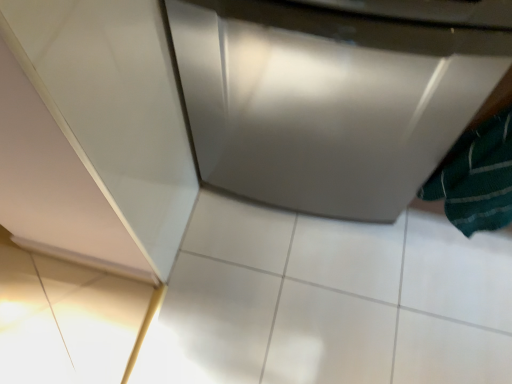
Question: Is satin silver dishwasher at center facing towards green textured towel at lower right?

Choices:
 (A) yes
 (B) no

Answer: (B)

Question: Does satin silver dishwasher at center have a greater width compared to green textured towel at lower right?

Choices:
 (A) no
 (B) yes

Answer: (B)

Question: Is satin silver dishwasher at center looking in the opposite direction of green textured towel at lower right?

Choices:
 (A) yes
 (B) no

Answer: (B)

Question: Is the depth of satin silver dishwasher at center less than that of green textured towel at lower right?

Choices:
 (A) no
 (B) yes

Answer: (A)

Question: Is satin silver dishwasher at center further to camera compared to green textured towel at lower right?

Choices:
 (A) no
 (B) yes

Answer: (B)

Question: Is satin silver dishwasher at center completely or partially outside of green textured towel at lower right?

Choices:
 (A) no
 (B) yes

Answer: (B)

Question: Can you confirm if green textured towel at lower right is wider than satin silver dishwasher at center?

Choices:
 (A) yes
 (B) no

Answer: (B)

Question: From the image's perspective, is green textured towel at lower right located above satin silver dishwasher at center?

Choices:
 (A) no
 (B) yes

Answer: (A)

Question: Can you confirm if green textured towel at lower right is positioned to the right of satin silver dishwasher at center?

Choices:
 (A) yes
 (B) no

Answer: (A)

Question: From the image's perspective, does green textured towel at lower right appear lower than satin silver dishwasher at center?

Choices:
 (A) no
 (B) yes

Answer: (B)

Question: Is green textured towel at lower right aimed at satin silver dishwasher at center?

Choices:
 (A) no
 (B) yes

Answer: (A)

Question: Is green textured towel at lower right positioned far away from satin silver dishwasher at center?

Choices:
 (A) no
 (B) yes

Answer: (A)

Question: Choose the correct answer: Is satin silver dishwasher at center inside green textured towel at lower right or outside it?

Choices:
 (A) outside
 (B) inside

Answer: (A)